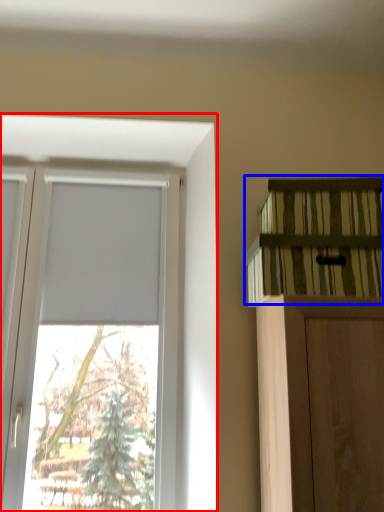
Question: Which object is further to the camera taking this photo, window (highlighted by a red box) or shelf (highlighted by a blue box)?

Choices:
 (A) window
 (B) shelf

Answer: (A)